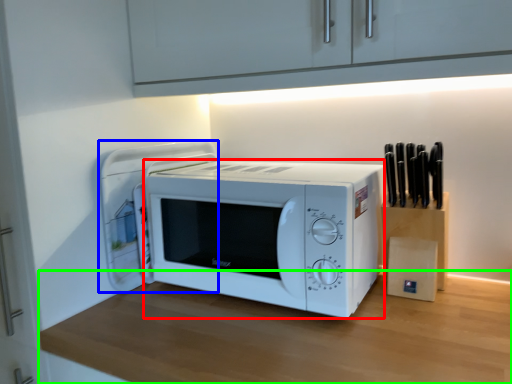
Question: Based on their relative distances, which object is farther from microwave oven (highlighted by a red box)? Choose from appliance (highlighted by a blue box) and table (highlighted by a green box).

Choices:
 (A) appliance
 (B) table

Answer: (A)